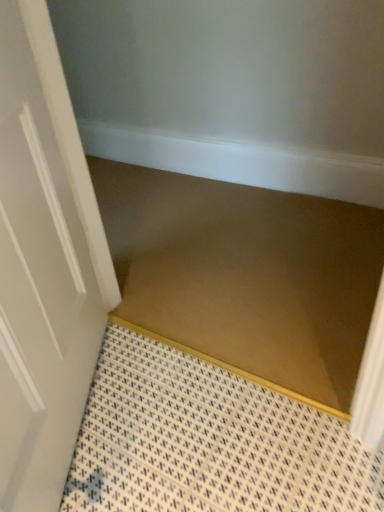
Question: Considering the relative sizes of white glossy door at left and brown matte stair at center in the image provided, is white glossy door at left bigger than brown matte stair at center?

Choices:
 (A) no
 (B) yes

Answer: (B)

Question: Is white glossy door at left oriented towards brown matte stair at center?

Choices:
 (A) no
 (B) yes

Answer: (A)

Question: Is white glossy door at left positioned with its back to brown matte stair at center?

Choices:
 (A) no
 (B) yes

Answer: (A)

Question: Is white glossy door at left surrounding brown matte stair at center?

Choices:
 (A) no
 (B) yes

Answer: (A)

Question: Is white glossy door at left positioned beyond the bounds of brown matte stair at center?

Choices:
 (A) no
 (B) yes

Answer: (B)

Question: Considering the relative sizes of white glossy door at left and brown matte stair at center in the image provided, is white glossy door at left taller than brown matte stair at center?

Choices:
 (A) yes
 (B) no

Answer: (A)

Question: Does brown matte stair at center have a lesser height compared to white glossy door at left?

Choices:
 (A) no
 (B) yes

Answer: (B)

Question: Can you see brown matte stair at center touching white glossy door at left?

Choices:
 (A) yes
 (B) no

Answer: (B)

Question: Would you consider brown matte stair at center to be distant from white glossy door at left?

Choices:
 (A) yes
 (B) no

Answer: (B)

Question: From a real-world perspective, is brown matte stair at center positioned over white glossy door at left based on gravity?

Choices:
 (A) no
 (B) yes

Answer: (A)

Question: Can you confirm if brown matte stair at center is wider than white glossy door at left?

Choices:
 (A) yes
 (B) no

Answer: (A)

Question: Is brown matte stair at center closer to camera compared to white glossy door at left?

Choices:
 (A) no
 (B) yes

Answer: (A)

Question: Considering their positions, is brown matte stair at center located in front of or behind white glossy door at left?

Choices:
 (A) behind
 (B) front

Answer: (A)